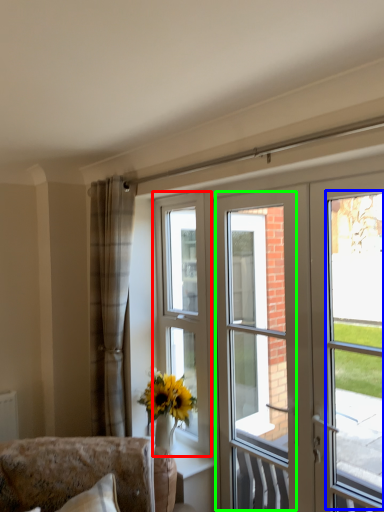
Question: Estimate the real-world distances between objects in this image. Which object is closer to window (highlighted by a red box), window screen (highlighted by a blue box) or screen door (highlighted by a green box)?

Choices:
 (A) window screen
 (B) screen door

Answer: (A)